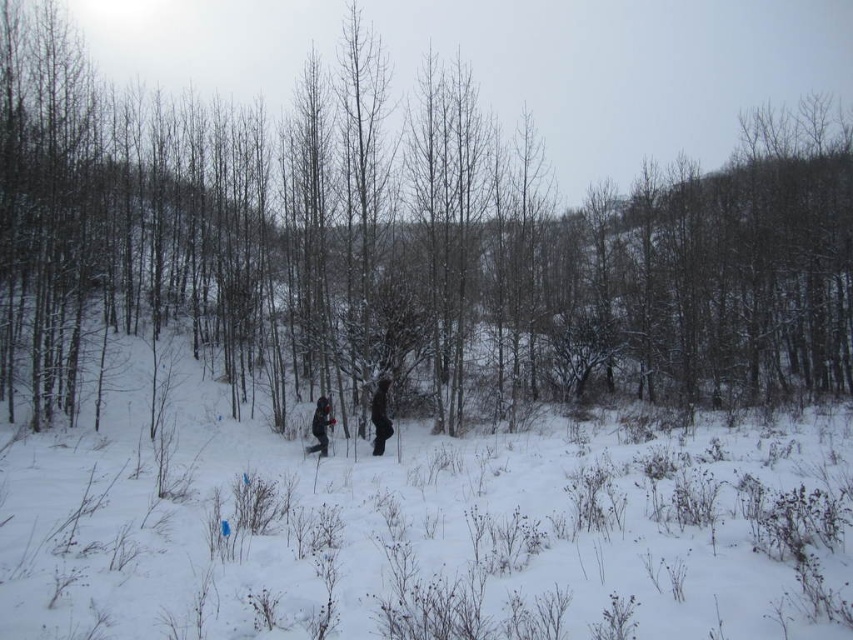
Question: Which point is farther from the camera taking this photo?

Choices:
 (A) (329, 401)
 (B) (323, 397)
 (C) (399, 266)

Answer: (C)

Question: Which of the following is the closest to the observer?

Choices:
 (A) snowy bark tree at center
 (B) dark gray fabric person at center

Answer: (B)

Question: Which of the following is the closest to the observer?

Choices:
 (A) (314, 419)
 (B) (376, 426)
 (C) (322, 456)

Answer: (C)

Question: Is snowy bark tree at center bigger than dark gray fabric person at center?

Choices:
 (A) no
 (B) yes

Answer: (B)

Question: Observing the image, what is the correct spatial positioning of white fluffy snow at center in reference to dark gray fabric couple at center?

Choices:
 (A) below
 (B) above

Answer: (B)

Question: Does white fluffy snow at center appear under dark gray fabric person at center?

Choices:
 (A) yes
 (B) no

Answer: (A)